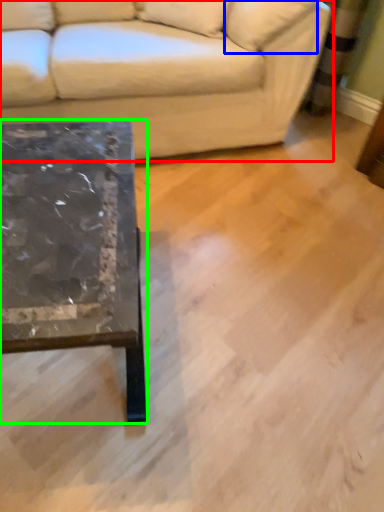
Question: Considering the real-world distances, which object is farthest from studio couch (highlighted by a red box)? pillow (highlighted by a blue box) or coffee table (highlighted by a green box)?

Choices:
 (A) pillow
 (B) coffee table

Answer: (B)